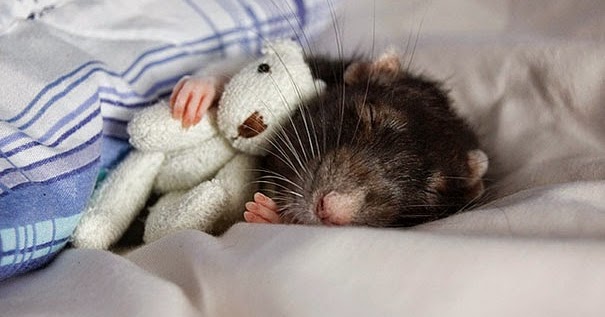
I want to click on sheets, so click(558, 253).